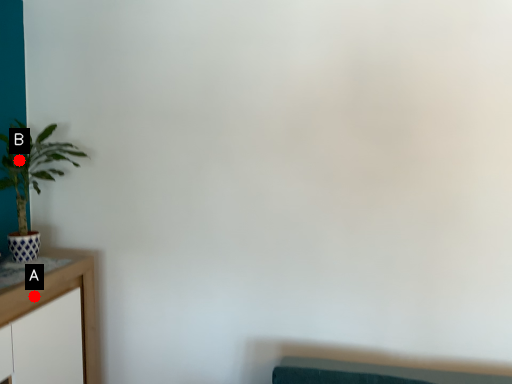
Question: Two points are circled on the image, labeled by A and B beside each circle. Among these points, which one is nearest to the camera?

Choices:
 (A) A is closer
 (B) B is closer

Answer: (A)